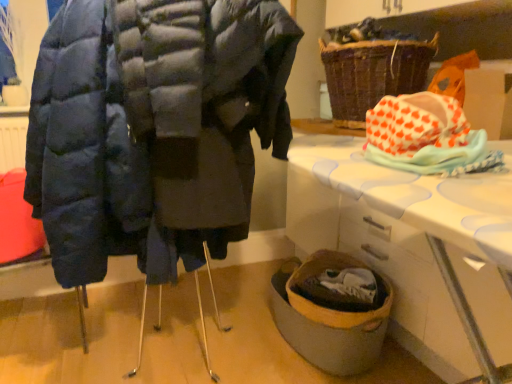
Locate an element on the screen. vacant space behind matte blue puffer coat at left is located at coordinates (189, 290).